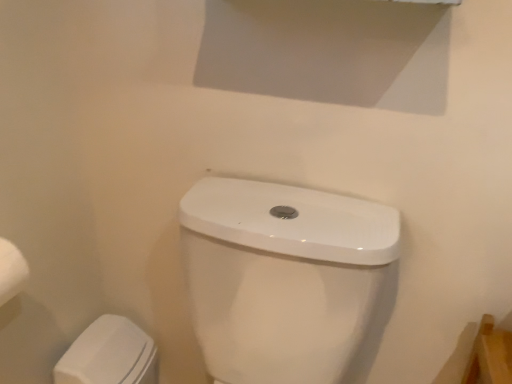
Question: Does white glossy toilet at lower center have a greater height compared to white glossy porcelain at lower left?

Choices:
 (A) yes
 (B) no

Answer: (A)

Question: From the image's perspective, is white glossy toilet at lower center located beneath white glossy porcelain at lower left?

Choices:
 (A) no
 (B) yes

Answer: (A)

Question: Is white glossy toilet at lower center located outside white glossy porcelain at lower left?

Choices:
 (A) yes
 (B) no

Answer: (A)

Question: Is white glossy toilet at lower center with white glossy porcelain at lower left?

Choices:
 (A) no
 (B) yes

Answer: (A)

Question: Considering the relative sizes of white glossy toilet at lower center and white glossy porcelain at lower left in the image provided, is white glossy toilet at lower center bigger than white glossy porcelain at lower left?

Choices:
 (A) yes
 (B) no

Answer: (A)

Question: From the image's perspective, does white glossy toilet at lower center appear higher than white glossy porcelain at lower left?

Choices:
 (A) yes
 (B) no

Answer: (A)

Question: From a real-world perspective, is white glossy porcelain at lower left under white glossy toilet at lower center?

Choices:
 (A) no
 (B) yes

Answer: (B)

Question: From a real-world perspective, is white glossy porcelain at lower left positioned over white glossy toilet at lower center based on gravity?

Choices:
 (A) yes
 (B) no

Answer: (B)

Question: Is white glossy porcelain at lower left positioned behind white glossy toilet at lower center?

Choices:
 (A) no
 (B) yes

Answer: (B)

Question: Are white glossy porcelain at lower left and white glossy toilet at lower center beside each other?

Choices:
 (A) no
 (B) yes

Answer: (A)

Question: Can you confirm if white glossy porcelain at lower left is smaller than white glossy toilet at lower center?

Choices:
 (A) yes
 (B) no

Answer: (A)

Question: From the image's perspective, is white glossy porcelain at lower left beneath white glossy toilet at lower center?

Choices:
 (A) no
 (B) yes

Answer: (B)

Question: Based on their sizes in the image, would you say white glossy toilet at lower center is bigger or smaller than white glossy porcelain at lower left?

Choices:
 (A) small
 (B) big

Answer: (B)